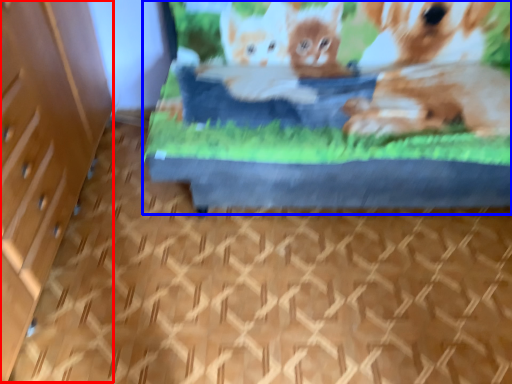
Question: Which point is closer to the camera, file cabinet (highlighted by a red box) or bed (highlighted by a blue box)?

Choices:
 (A) file cabinet
 (B) bed

Answer: (A)